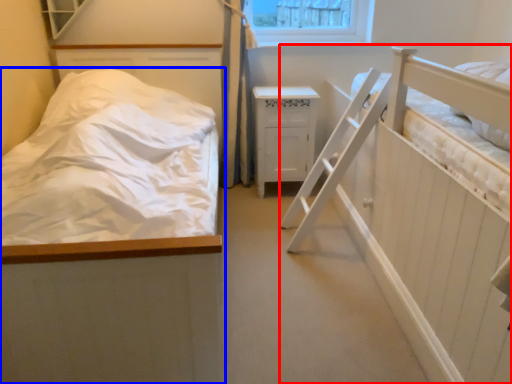
Question: Which object appears farthest to the camera in this image, hospital bed (highlighted by a red box) or bed (highlighted by a blue box)?

Choices:
 (A) hospital bed
 (B) bed

Answer: (B)